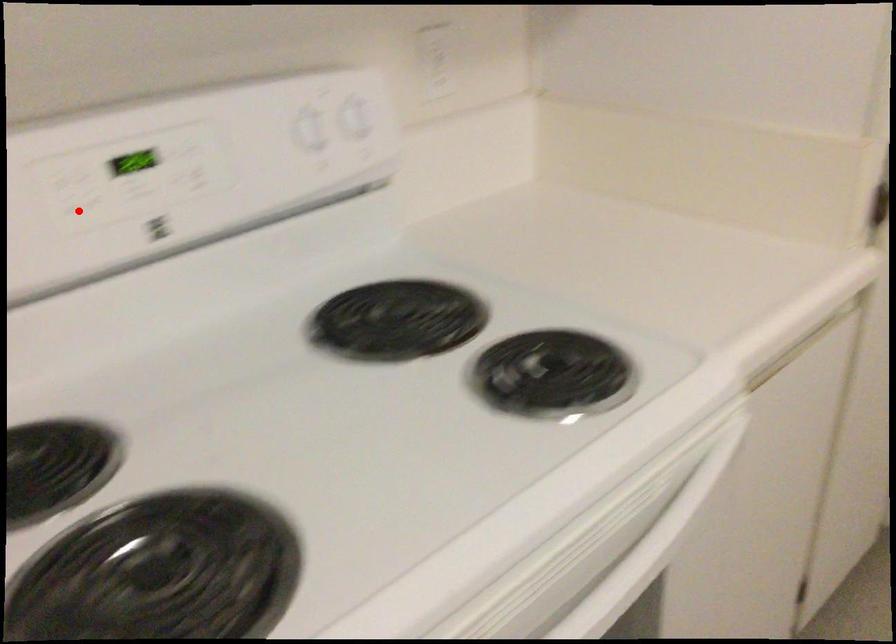
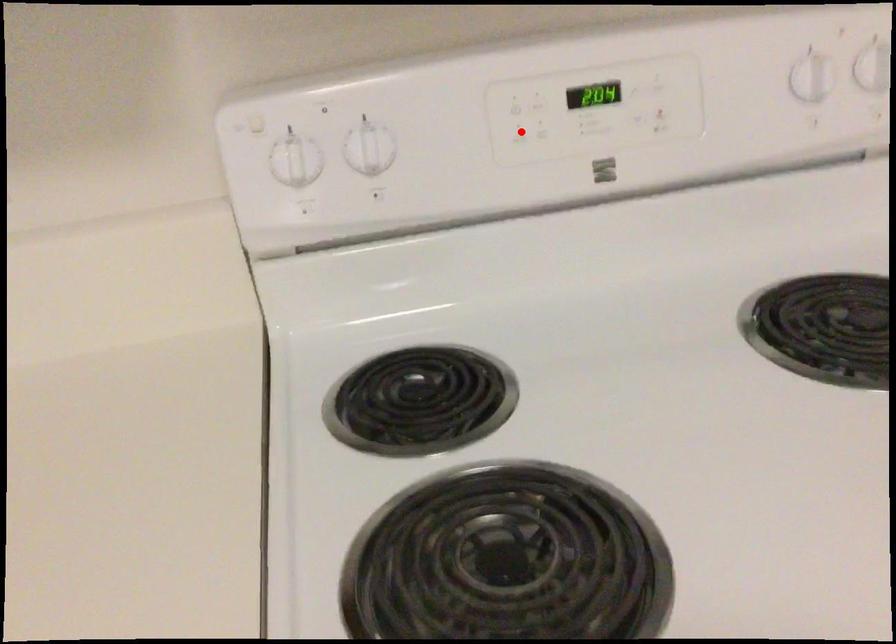
I am providing you with two images of the same scene from different viewpoints. A red point is marked on the first image and another point is marked on the second image. Are the points marked in image1 and image2 representing the same 3D position?

Yes